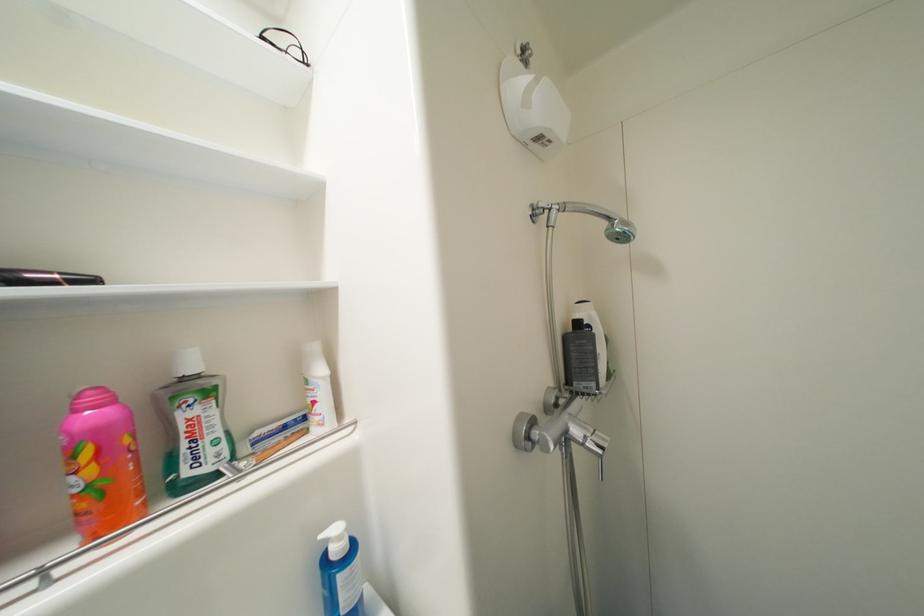
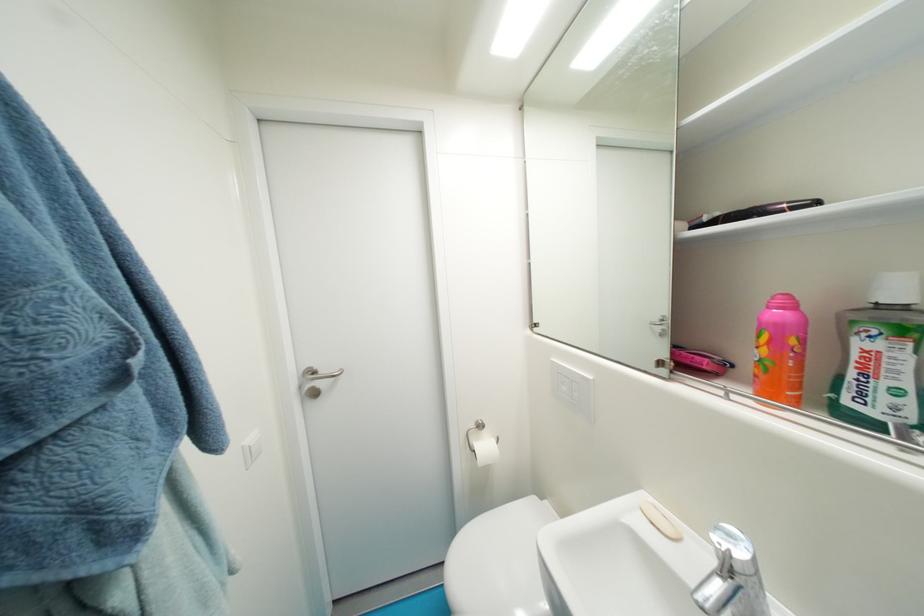
In the second image, find the point that corresponds to point (108, 485) in the first image.

(774, 363)